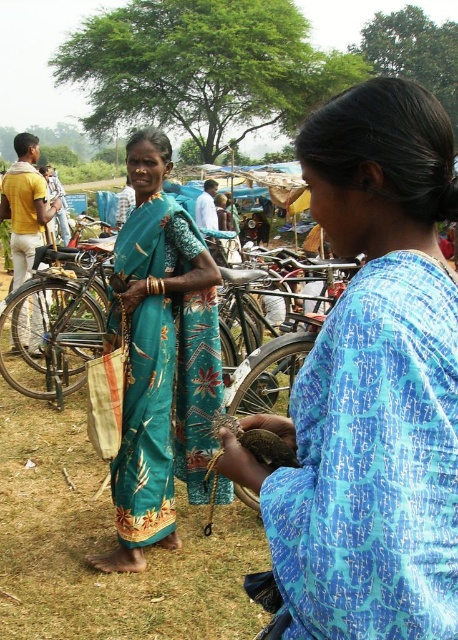
Question: Does blue printed dress at center have a greater width compared to teal printed sari at center?

Choices:
 (A) no
 (B) yes

Answer: (A)

Question: Which object appears farthest from the camera in this image?

Choices:
 (A) blue printed dress at center
 (B) metallic silver bicycle at left

Answer: (B)

Question: Estimate the real-world distances between objects in this image. Which object is closer to the blue printed dress at center?

Choices:
 (A) teal printed sari at center
 (B) yellow cotton shirt at left
 (C) metallic silver bicycle at left

Answer: (A)

Question: Is teal printed sari at center wider than yellow cotton shirt at left?

Choices:
 (A) yes
 (B) no

Answer: (B)

Question: Which point is closer to the camera?

Choices:
 (A) (55, 308)
 (B) (127, 365)
 (C) (18, 264)

Answer: (B)

Question: From the image, what is the correct spatial relationship of metallic silver bicycle at left in relation to yellow cotton shirt at left?

Choices:
 (A) right
 (B) left

Answer: (A)